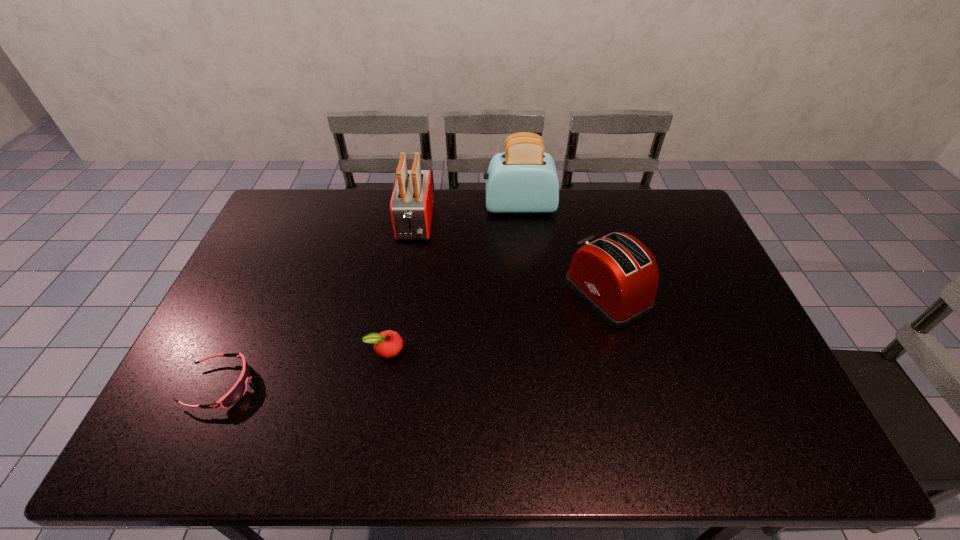
The width and height of the screenshot is (960, 540). In order to click on object that is the third closest to the shortest object in this screenshot , I will do `click(616, 275)`.

Choose which object is the third nearest neighbor to the leftmost toaster. Please provide its 2D coordinates. Your answer should be formatted as a tuple, i.e. [(x, y)], where the tuple contains the x and y coordinates of a point satisfying the conditions above.

[(616, 275)]

At what (x,y) coordinates should I click in order to perform the action: click on the closest toaster relative to the leftmost toaster. Please return your answer as a coordinate pair (x, y). The height and width of the screenshot is (540, 960). Looking at the image, I should click on (523, 179).

Locate an element on the screen. This screenshot has width=960, height=540. toaster that is the second closest one to the leftmost toaster is located at coordinates (616, 275).

This screenshot has height=540, width=960. In order to click on free point that satisfies the following two spatial constraints: 1. on the front-facing side of the third tallest object; 2. on the right side of the leftmost toaster in this screenshot , I will do `click(404, 294)`.

Where is `vacant region that satisfies the following two spatial constraints: 1. on the front side of the second shortest object; 2. on the front-facing side of the leftmost object`? This screenshot has height=540, width=960. vacant region that satisfies the following two spatial constraints: 1. on the front side of the second shortest object; 2. on the front-facing side of the leftmost object is located at coordinates (379, 386).

Find the location of a particular element. This screenshot has height=540, width=960. vacant space that satisfies the following two spatial constraints: 1. on the front-facing side of the leftmost toaster; 2. on the right side of the shortest toaster is located at coordinates (404, 294).

Identify the location of vacant space that satisfies the following two spatial constraints: 1. on the front-facing side of the leftmost toaster; 2. on the front-facing side of the goggles. The height and width of the screenshot is (540, 960). (389, 386).